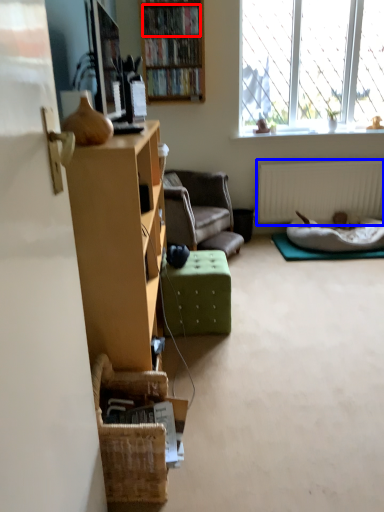
Question: Which of the following is the farthest to the observer, book (highlighted by a red box) or radiator (highlighted by a blue box)?

Choices:
 (A) book
 (B) radiator

Answer: (B)